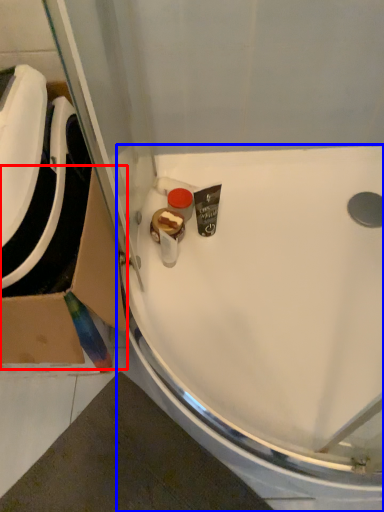
Question: Which of the following is the closest to the observer, cardboard box (highlighted by a red box) or sink (highlighted by a blue box)?

Choices:
 (A) cardboard box
 (B) sink

Answer: (A)